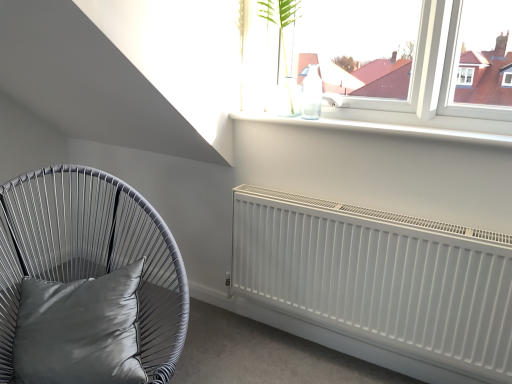
Question: Would you say satin grey cushion at left is inside or outside translucent glass vase at upper center?

Choices:
 (A) outside
 (B) inside

Answer: (A)

Question: From the image's perspective, is satin grey cushion at left located above or below translucent glass vase at upper center?

Choices:
 (A) above
 (B) below

Answer: (B)

Question: Considering the real-world distances, which object is farthest from the white matte radiator at lower right?

Choices:
 (A) satin gray pillow at lower left
 (B) translucent glass vase at upper center
 (C) satin grey cushion at left

Answer: (A)

Question: Estimate the real-world distances between objects in this image. Which object is farther from the white matte radiator at lower right?

Choices:
 (A) translucent glass vase at upper center
 (B) satin gray pillow at lower left
 (C) satin grey cushion at left

Answer: (B)